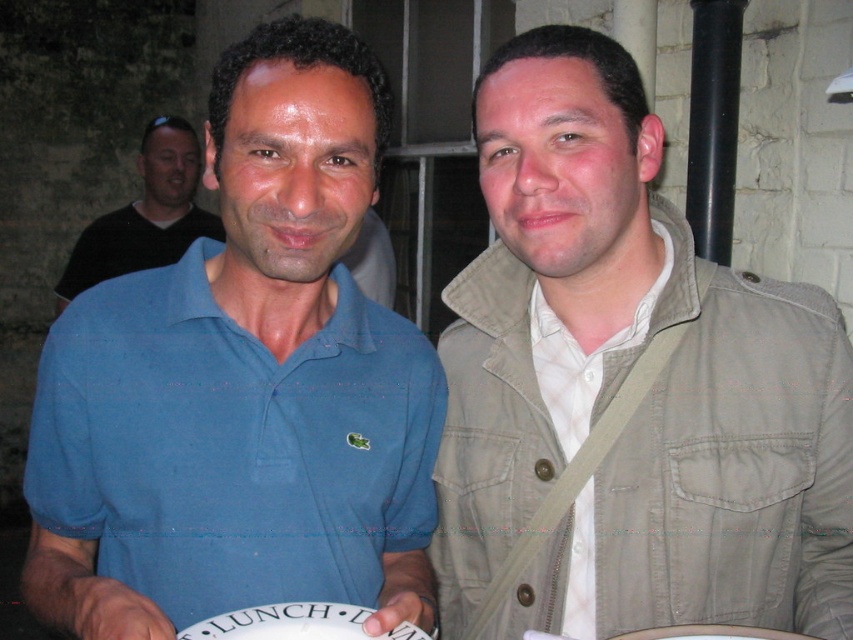
Question: Does khaki cotton jacket at center have a greater width compared to white textured shirt at center?

Choices:
 (A) no
 (B) yes

Answer: (B)

Question: Which object is the farthest from the white textured shirt at center?

Choices:
 (A) khaki cotton jacket at center
 (B) black shirt at upper left

Answer: (B)

Question: Which object is farther from the camera taking this photo?

Choices:
 (A) white paper plate at center
 (B) blue cotton polo shirt at center

Answer: (A)

Question: Which object appears farthest from the camera in this image?

Choices:
 (A) blue cotton polo shirt at center
 (B) khaki cotton jacket at center
 (C) white paper plate at center

Answer: (B)

Question: Can you confirm if blue cotton polo shirt at center is thinner than white paper plate at center?

Choices:
 (A) no
 (B) yes

Answer: (A)

Question: Can you confirm if blue cotton polo shirt at center is positioned below white textured shirt at center?

Choices:
 (A) yes
 (B) no

Answer: (B)